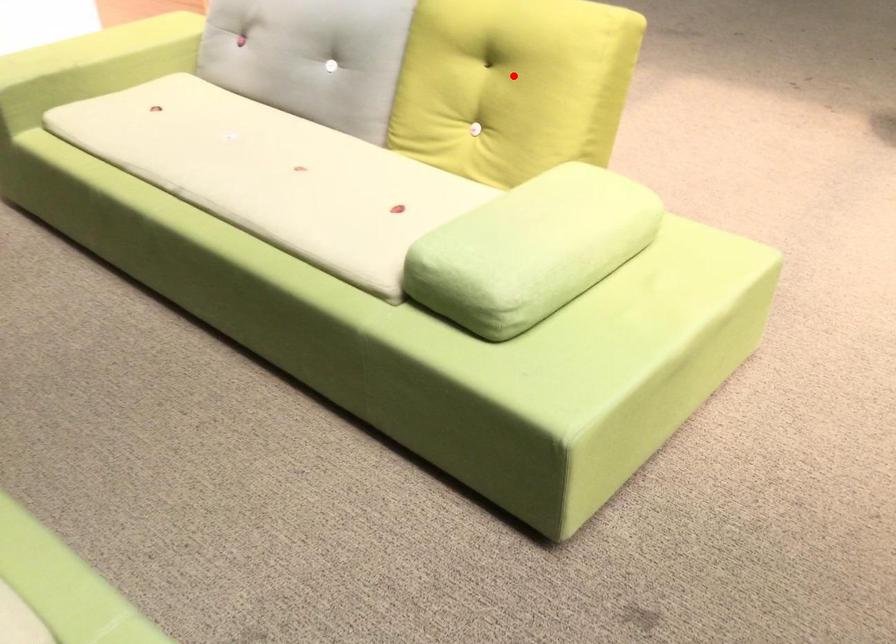
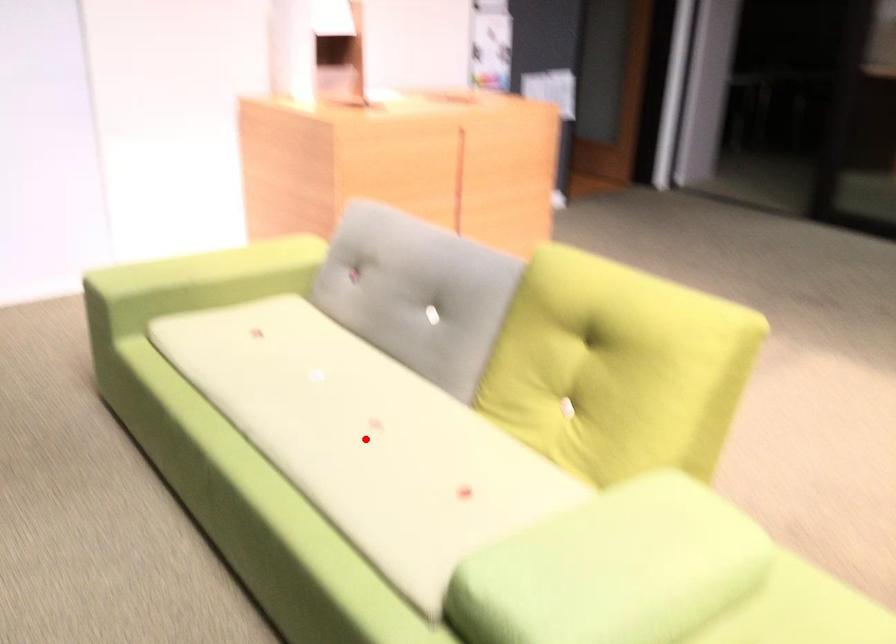
I am providing you with two images of the same scene from different viewpoints. A red point is marked on the first image and another point is marked on the second image. Is the marked point in image1 the same physical position as the marked point in image2?

No